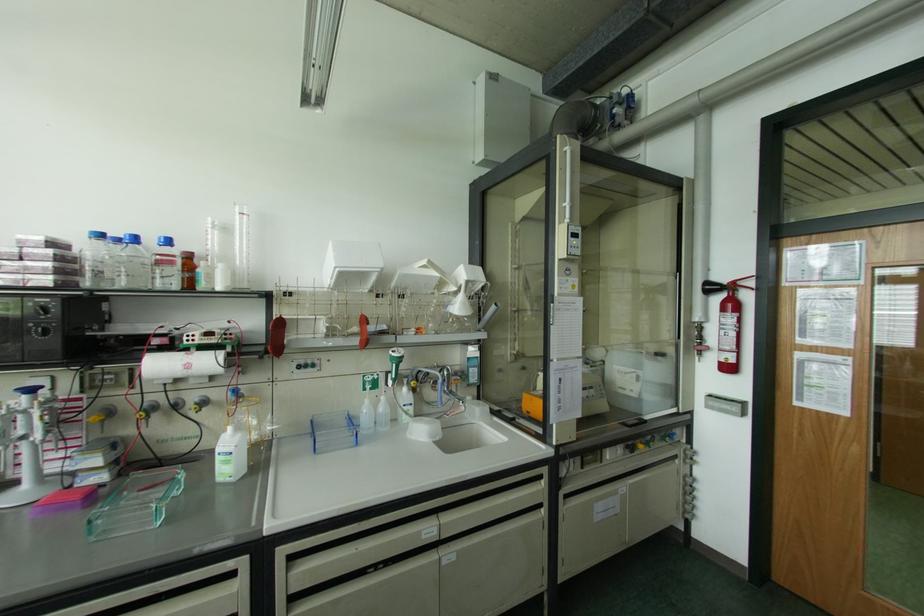
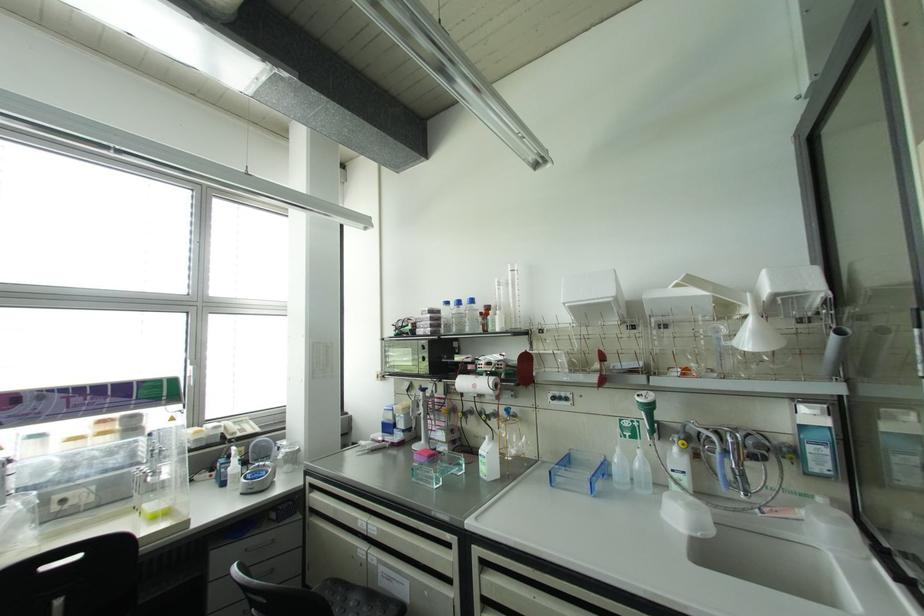
Where in the second image is the point corresponding to point (167, 241) from the first image?

(471, 301)